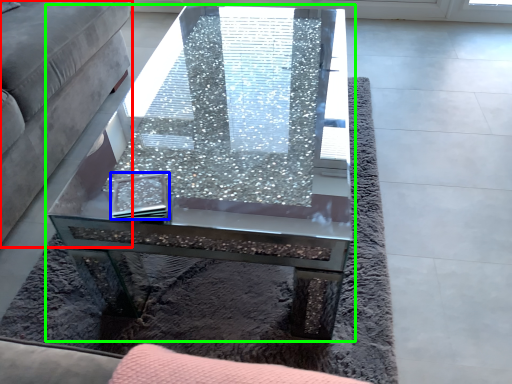
Question: Which is nearer to the studio couch (highlighted by a red box)? pad (highlighted by a blue box) or coffee table (highlighted by a green box).

Choices:
 (A) pad
 (B) coffee table

Answer: (B)